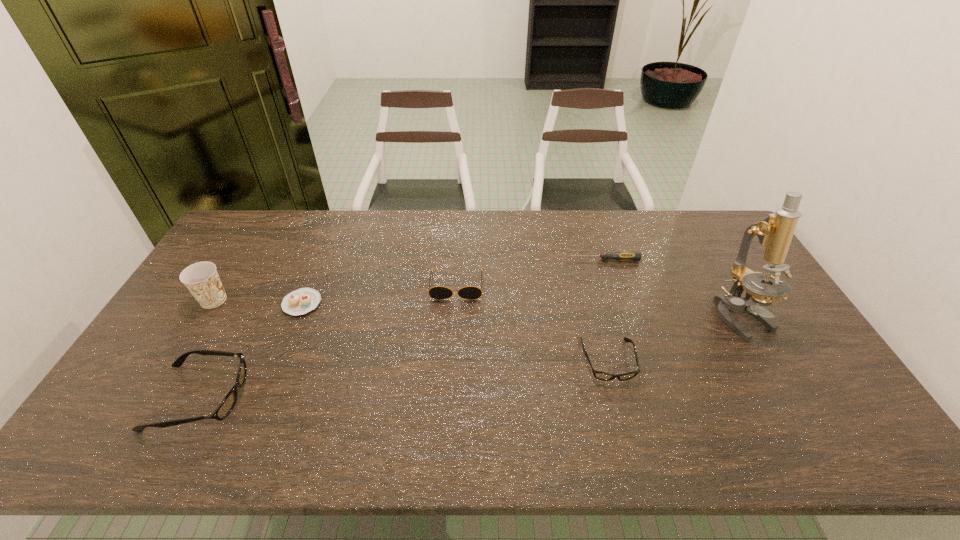
The image size is (960, 540). In order to click on free space that satisfies the following two spatial constraints: 1. on the front-facing side of the sunglasses; 2. on the right side of the rightmost object in this screenshot , I will do `click(455, 316)`.

You are a GUI agent. You are given a task and a screenshot of the screen. Output one action in this format:
    pyautogui.click(x=<x>, y=<y>)
    Task: Click on the free point that satisfies the following two spatial constraints: 1. on the front-facing side of the right spectacles; 2. on the front-facing side of the taller spectacles
    
    Given the screenshot: What is the action you would take?
    pyautogui.click(x=617, y=397)

What are the coordinates of `free space that satisfies the following two spatial constraints: 1. insert the farthest object into a screw head; 2. on the right side of the microscope` in the screenshot? It's located at (622, 316).